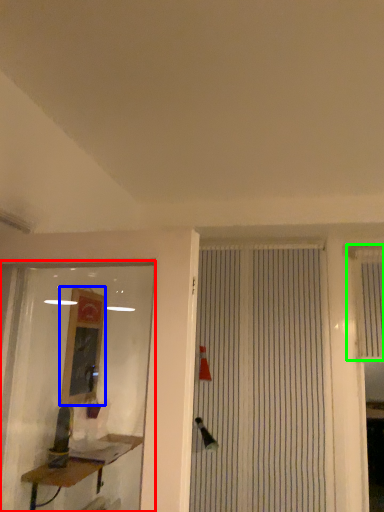
Question: Considering the real-world distances, which object is farthest from shop window (highlighted by a red box)? job (highlighted by a blue box) or shutter (highlighted by a green box)?

Choices:
 (A) job
 (B) shutter

Answer: (B)